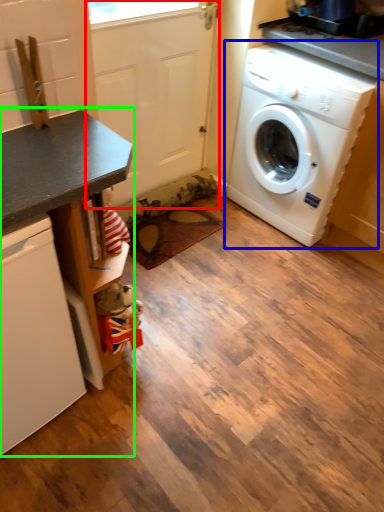
Question: Estimate the real-world distances between objects in this image. Which object is closer to screen door (highlighted by a red box), washing machine (highlighted by a blue box) or counter (highlighted by a green box)?

Choices:
 (A) washing machine
 (B) counter

Answer: (A)